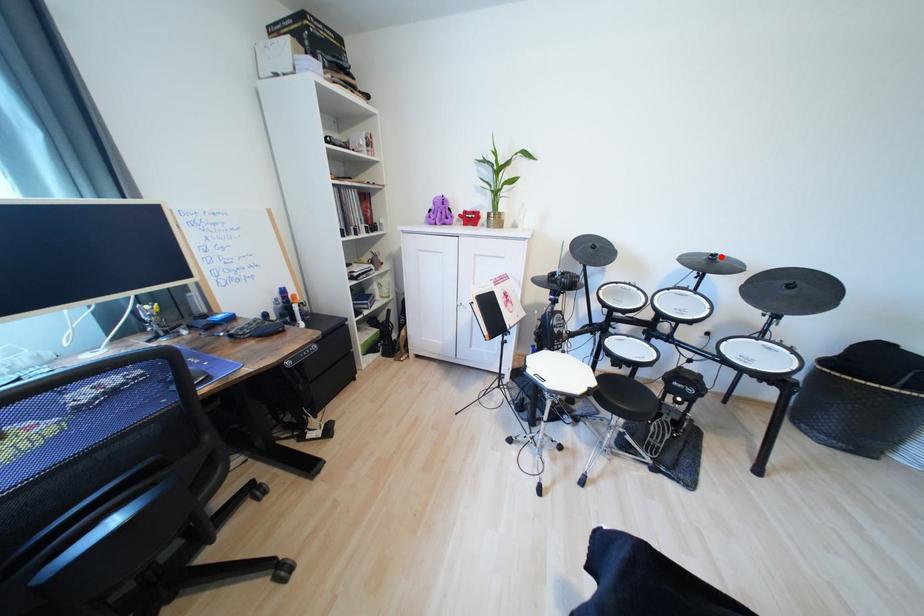
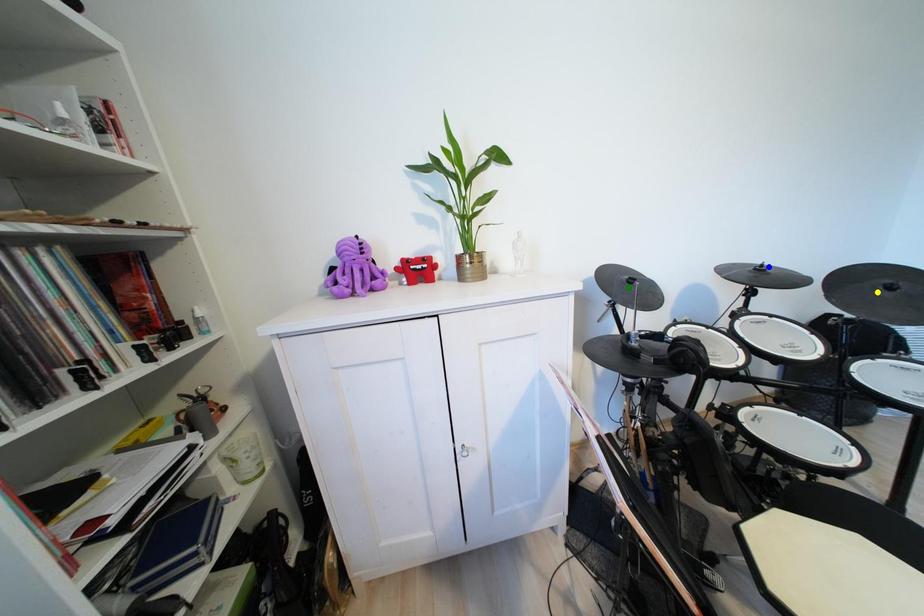
Question: I am providing you with two images of the same scene from different viewpoints. A red point is marked on the first image. You are given multiple points on the second image. Can you choose the point in image 2 that corresponds to the point in image 1?

Choices:
 (A) green point
 (B) blue point
 (C) yellow point

Answer: (B)